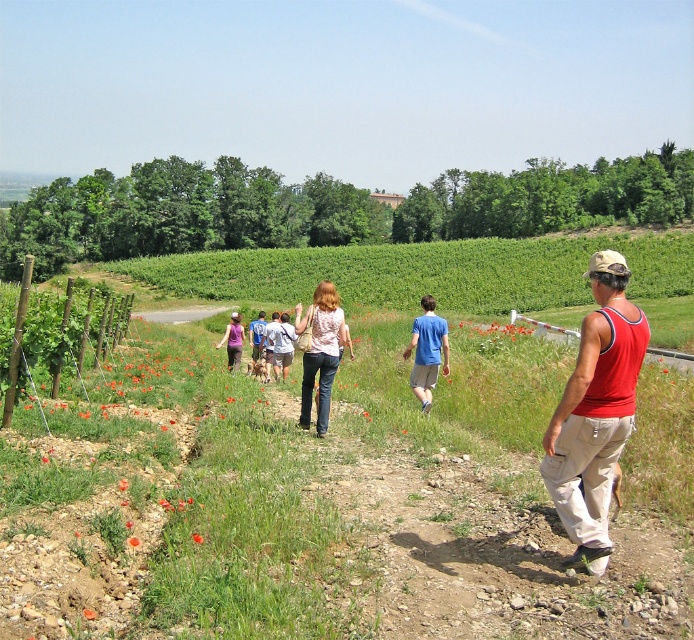
You are a photographer standing at the starting point of the dirt path. You want to take a photo that includes both the red sleeveless tank top at right and the blue cotton shirt at center. Which person should you focus on first to ensure both are in frame?

The red sleeveless tank top at right is taller than the blue cotton shirt at center, so focusing on the red sleeveless tank top at right first will ensure both are in frame since it is taller and likely more visible.

You are a photographer positioned at the back of the group. You want to take a photo that includes both the red sleeveless tank top at right and the blue cotton shirt at center. Based on their positions, which person should be closer to the camera?

The red sleeveless tank top at right is in front of the blue cotton shirt at center, so the person wearing the red sleeveless tank top at right is closer to the camera.